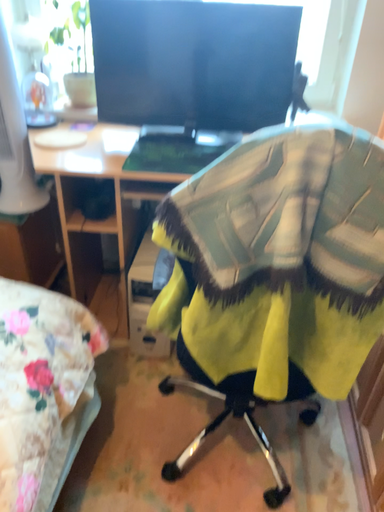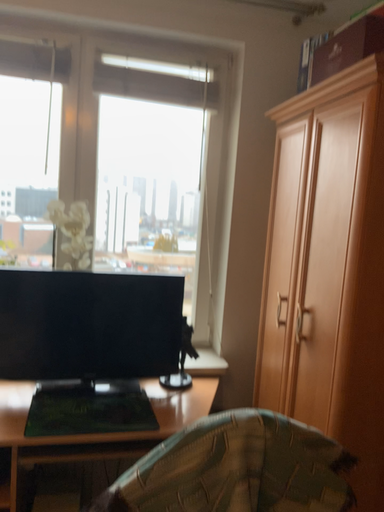
Question: Which way did the camera rotate in the video?

Choices:
 (A) rotated right
 (B) rotated left

Answer: (A)